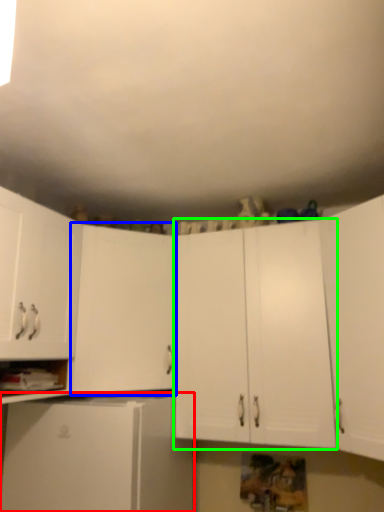
Question: Based on their relative distances, which object is farther from cabinetry (highlighted by a red box)? Choose from cabinetry (highlighted by a blue box) and cabinetry (highlighted by a green box).

Choices:
 (A) cabinetry
 (B) cabinetry

Answer: (B)